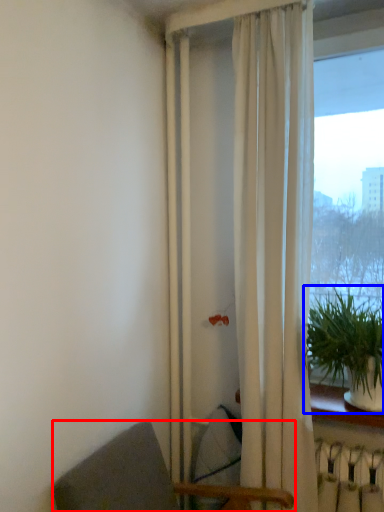
Question: Which of the following is the farthest to the observer, chair (highlighted by a red box) or houseplant (highlighted by a blue box)?

Choices:
 (A) chair
 (B) houseplant

Answer: (B)